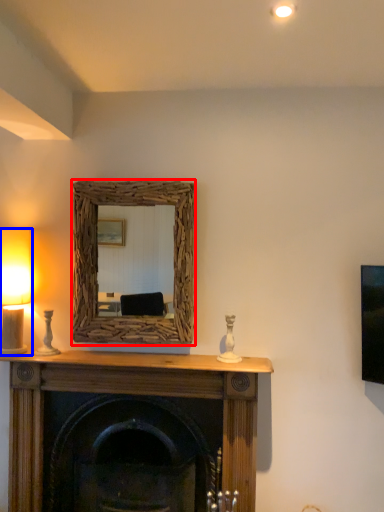
Question: Which point is further to the camera, picture frame (highlighted by a red box) or table lamp (highlighted by a blue box)?

Choices:
 (A) picture frame
 (B) table lamp

Answer: (A)